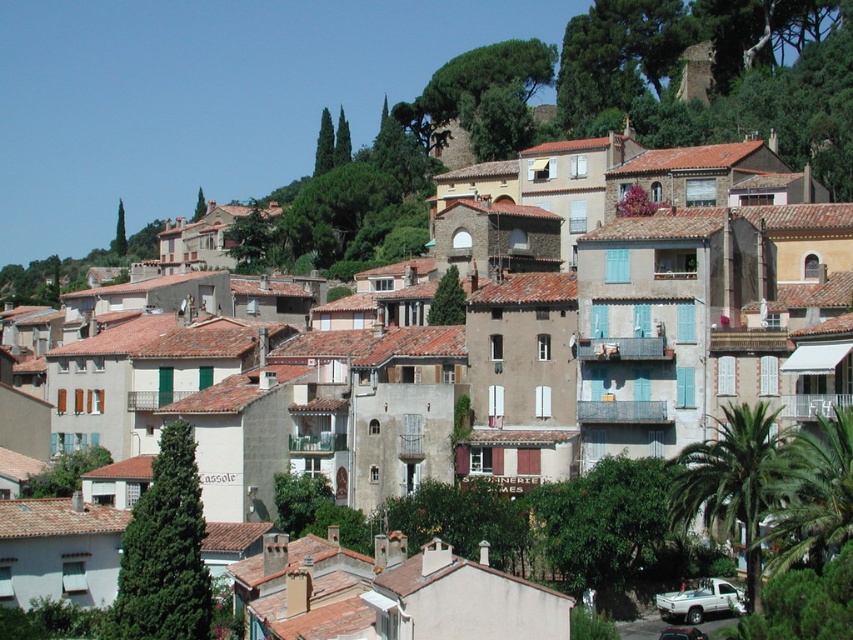
Question: Among these objects, which one is farthest from the camera?

Choices:
 (A) metallic silver car at lower center
 (B) white matte truck at lower right

Answer: (B)

Question: In this image, where is white matte truck at lower right located relative to metallic silver car at lower center?

Choices:
 (A) above
 (B) below

Answer: (A)

Question: Among these objects, which one is nearest to the camera?

Choices:
 (A) white matte truck at lower right
 (B) metallic silver car at lower center

Answer: (B)

Question: Which point is farther from the camera taking this photo?

Choices:
 (A) (730, 605)
 (B) (689, 632)

Answer: (A)

Question: Considering the relative positions of white matte truck at lower right and metallic silver car at lower center in the image provided, where is white matte truck at lower right located with respect to metallic silver car at lower center?

Choices:
 (A) right
 (B) left

Answer: (A)

Question: Can you confirm if white matte truck at lower right is bigger than metallic silver car at lower center?

Choices:
 (A) no
 (B) yes

Answer: (A)